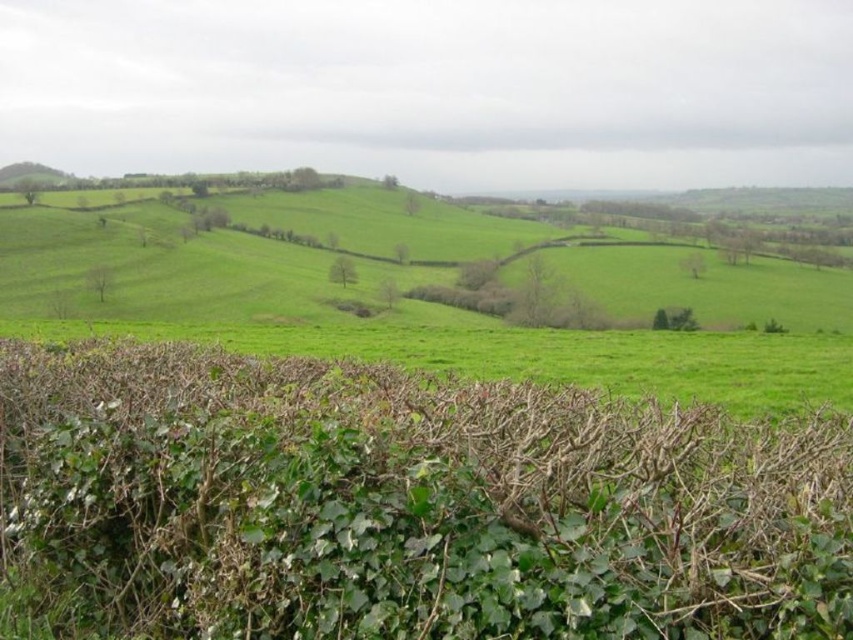
You are standing at the center of the image and want to find the green leafy hedge at lower center. Which direction should you look to locate it?

You should look downward because the green leafy hedge at lower center is positioned at point (405, 502), which is in the lower part of the image from the center.

You are standing in the rural landscape and want to walk from the point at coordinates point (173,406) to the point at coordinates point (374,348). Considering the dense hedge in the foreground and the rolling hills beyond, which direction should you take to avoid the dense hedge?

Since point (173,406) is in front of point (374,348), you should move towards the rolling hills beyond the dense hedge to reach point (374,348) without encountering the hedge.

Looking at this image, you are standing at the edge of the green grassy field at lower left and want to walk towards the green grassy hillside at left. Which direction should you head to reach the hillside?

The green grassy field at lower left is in front of the green grassy hillside at left, so you should head forward towards the hillside.